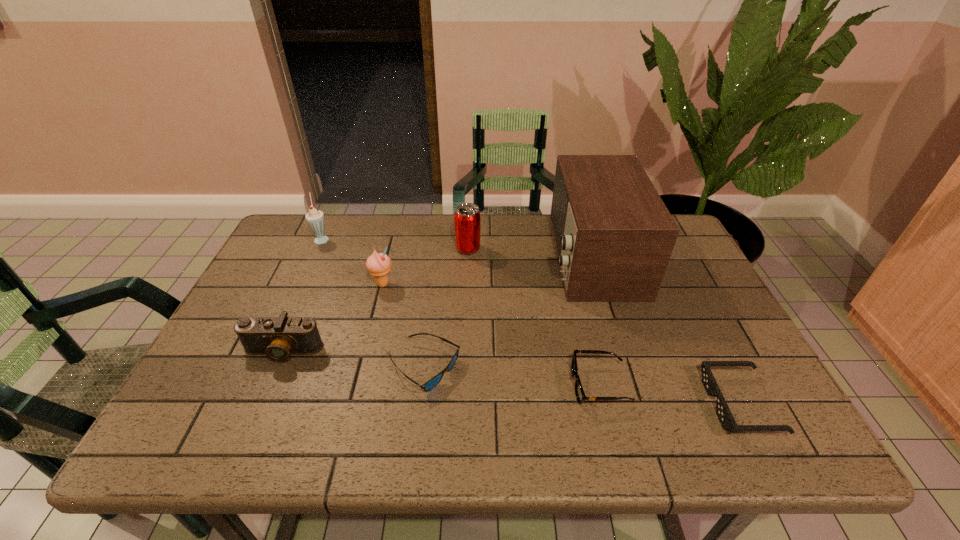
Identify the location of vacant area located 0.250m on the front-facing side of the rightmost object. (595, 404).

You are a GUI agent. You are given a task and a screenshot of the screen. Output one action in this format:
    pyautogui.click(x=<x>, y=<y>)
    Task: Click on the free region located on the front-facing side of the rightmost object
    The height and width of the screenshot is (540, 960).
    Given the screenshot: What is the action you would take?
    pyautogui.click(x=605, y=404)

Find the location of a particular element. vacant space positioned on the front-facing side of the rightmost object is located at coordinates (637, 404).

Locate an element on the screen. radio receiver that is at the far edge is located at coordinates 614,236.

Find the location of a particular element. This screenshot has width=960, height=540. soda can positioned at the far edge is located at coordinates (467, 218).

Where is `milkshake positioned at the far edge`? The image size is (960, 540). milkshake positioned at the far edge is located at coordinates (315, 218).

You are a GUI agent. You are given a task and a screenshot of the screen. Output one action in this format:
    pyautogui.click(x=<x>, y=<y>)
    Task: Click on the object that is at the near edge
    Image resolution: width=960 pixels, height=540 pixels.
    Given the screenshot: What is the action you would take?
    pyautogui.click(x=727, y=421)

The width and height of the screenshot is (960, 540). In order to click on milkshake located at the left edge in this screenshot , I will do `click(315, 218)`.

This screenshot has width=960, height=540. Identify the location of camera present at the left edge. [279, 337].

Image resolution: width=960 pixels, height=540 pixels. What are the coordinates of `object that is at the right edge` in the screenshot? It's located at (727, 421).